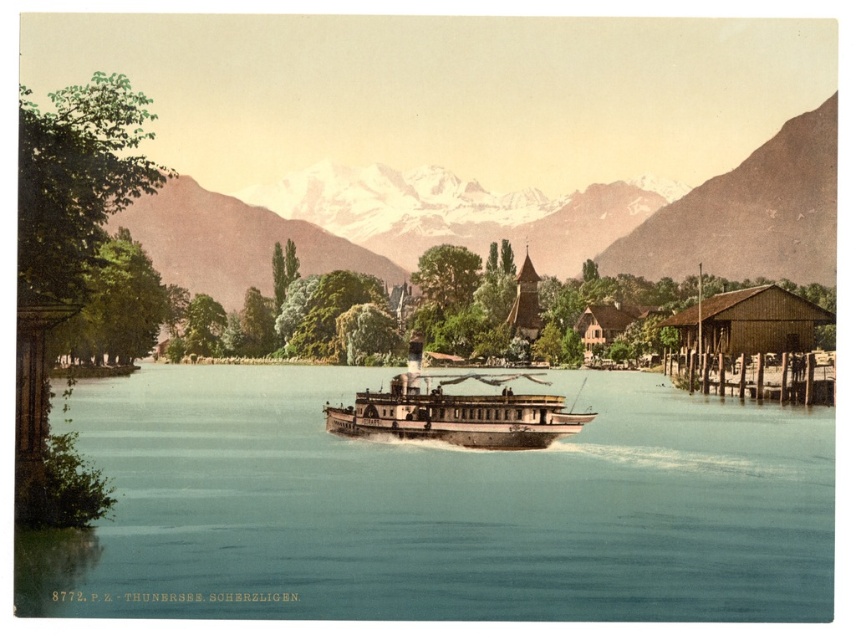
You are a photographer planning to capture the entire wooden polished boat at center and the blue water at center in one frame. Given the scene described, can you fit both the boat and the water into your camera viewfinder without moving the camera?

The blue water at center has a larger width than the wooden polished boat at center, so yes, both can be captured in one frame as the water spans a wider area than the boat.